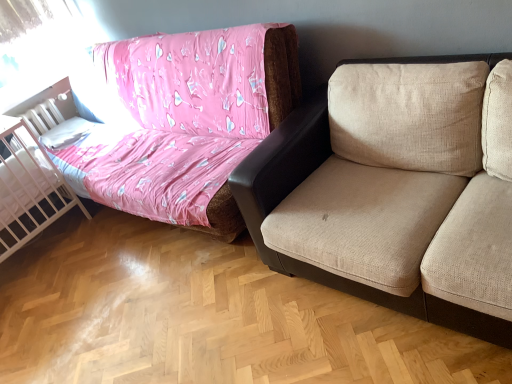
Question: Considering the positions of white mesh crib at left and beige fabric studio couch at upper right in the image, is white mesh crib at left taller or shorter than beige fabric studio couch at upper right?

Choices:
 (A) short
 (B) tall

Answer: (A)

Question: Considering the positions of white mesh crib at left and beige fabric studio couch at upper right in the image, is white mesh crib at left bigger or smaller than beige fabric studio couch at upper right?

Choices:
 (A) small
 (B) big

Answer: (A)

Question: From the image's perspective, relative to beige fabric studio couch at upper right, is white mesh crib at left above or below?

Choices:
 (A) below
 (B) above

Answer: (A)

Question: Which is correct: beige fabric studio couch at upper right is inside white mesh crib at left, or outside of it?

Choices:
 (A) inside
 (B) outside

Answer: (B)

Question: Based on their sizes in the image, would you say beige fabric studio couch at upper right is bigger or smaller than white mesh crib at left?

Choices:
 (A) small
 (B) big

Answer: (B)

Question: Visually, is beige fabric studio couch at upper right positioned to the left or to the right of white mesh crib at left?

Choices:
 (A) right
 (B) left

Answer: (A)

Question: From a real-world perspective, is beige fabric studio couch at upper right physically located above or below white mesh crib at left?

Choices:
 (A) above
 (B) below

Answer: (A)